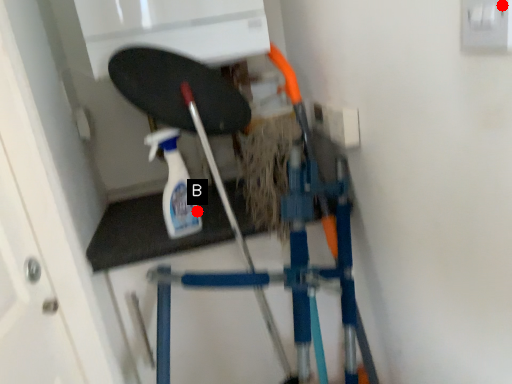
Question: Two points are circled on the image, labeled by A and B beside each circle. Among these points, which one is farthest from the camera?

Choices:
 (A) A is further
 (B) B is further

Answer: (B)